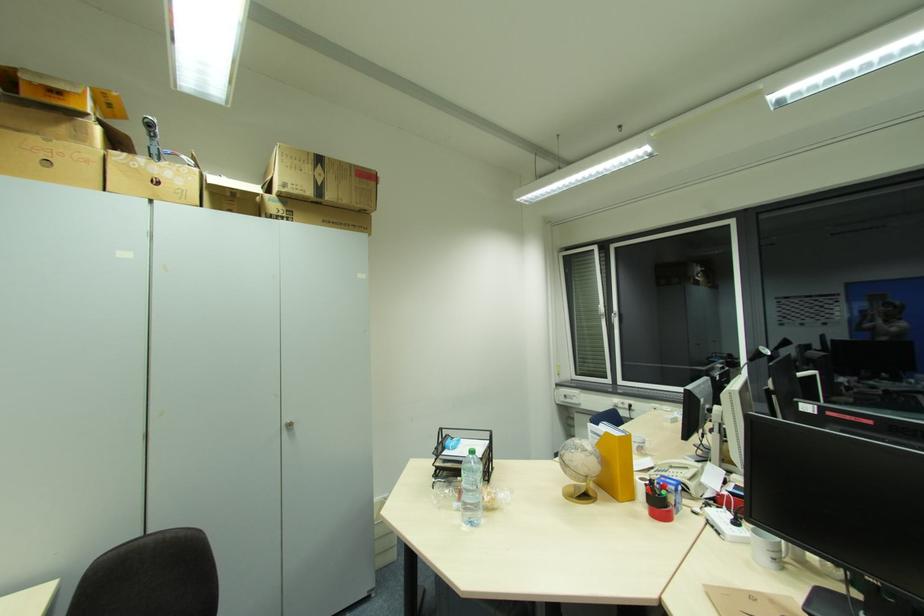
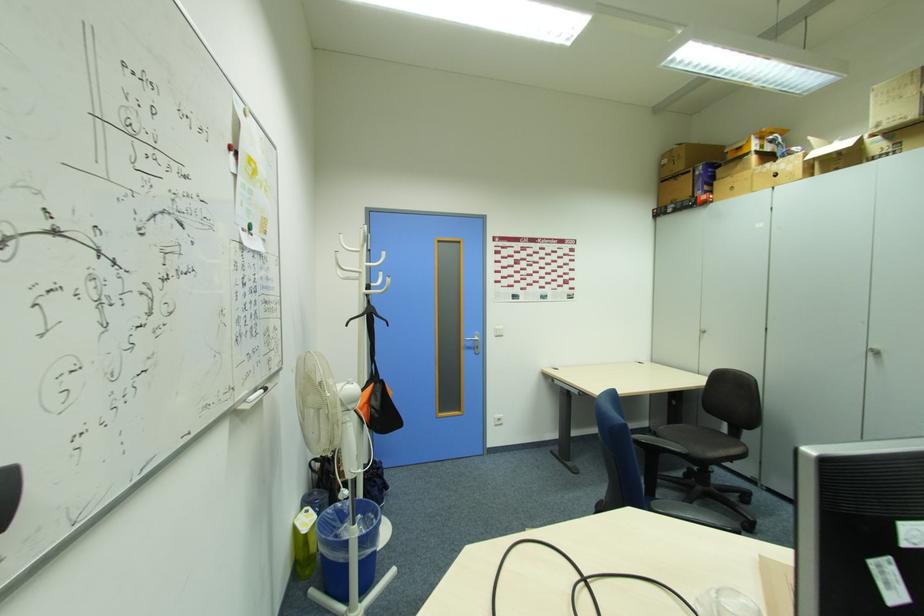
The point at (293, 187) is marked in the first image. Where is the corresponding point in the second image?

(889, 123)